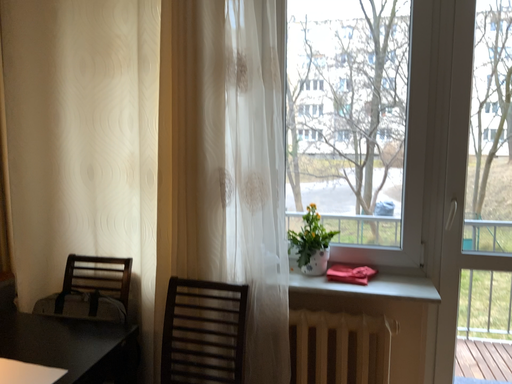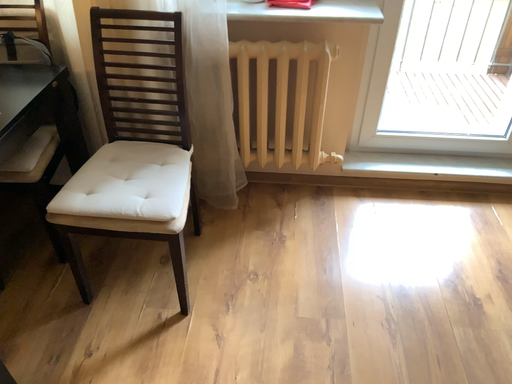
Question: How did the camera likely rotate when shooting the video?

Choices:
 (A) rotated upward
 (B) rotated downward

Answer: (B)